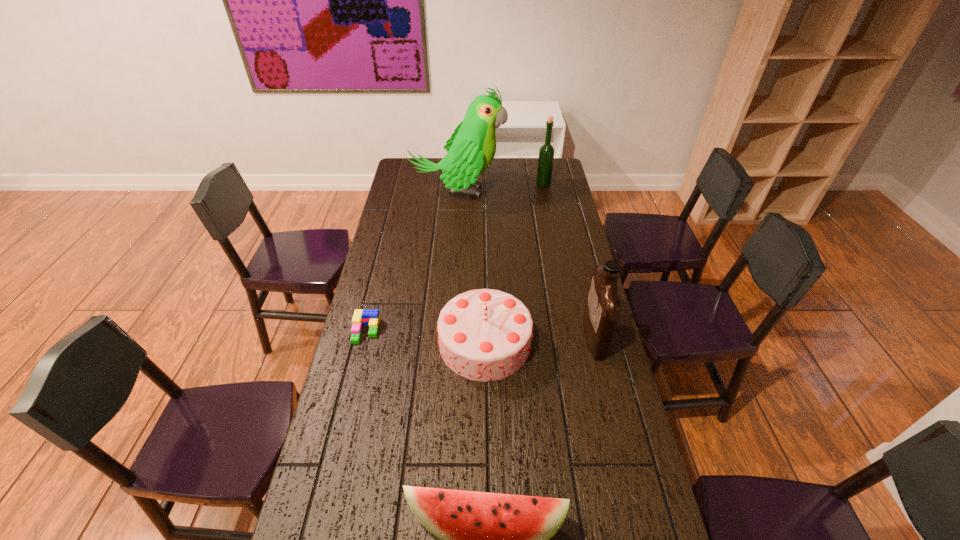
I want to click on free location located on the label side of the rightmost object, so click(x=522, y=337).

At what (x,y) coordinates should I click in order to perform the action: click on free point located 0.310m on the label side of the rightmost object. Please return your answer as a coordinate pair (x, y). The image size is (960, 540). Looking at the image, I should click on (492, 337).

Where is `free space located on the label side of the rightmost object`? free space located on the label side of the rightmost object is located at coordinates (481, 337).

At what (x,y) coordinates should I click in order to perform the action: click on free space located 0.240m on the right of the birthday cake. Please return your answer as a coordinate pair (x, y). This screenshot has height=540, width=960. Looking at the image, I should click on (604, 343).

Find the location of a particular element. The width and height of the screenshot is (960, 540). free space located on the right of the leftmost object is located at coordinates (425, 331).

The height and width of the screenshot is (540, 960). In order to click on parakeet positioned at the far edge in this screenshot , I will do `click(472, 147)`.

At what (x,y) coordinates should I click in order to perform the action: click on liquor present at the far edge. Please return your answer as a coordinate pair (x, y). The height and width of the screenshot is (540, 960). Looking at the image, I should click on (546, 152).

Locate an element on the screen. The width and height of the screenshot is (960, 540). parakeet located in the left edge section of the desktop is located at coordinates (472, 147).

The width and height of the screenshot is (960, 540). Find the location of `Lego located at the left edge`. Lego located at the left edge is located at coordinates (361, 317).

Locate an element on the screen. This screenshot has height=540, width=960. object that is at the far left corner is located at coordinates (472, 147).